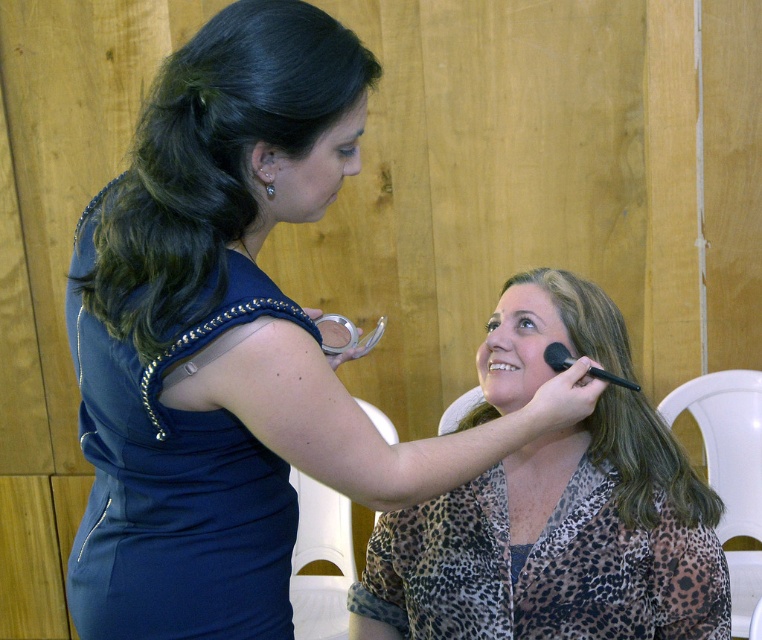
Which of these two, dark blue silky hair at upper left or white plastic chair at lower right, stands taller?

Standing taller between the two is white plastic chair at lower right.

Based on the photo, how distant is dark blue silky hair at upper left from white plastic chair at lower right?

dark blue silky hair at upper left is 4.87 feet from white plastic chair at lower right.

I want to click on dark blue silky hair at upper left, so click(213, 161).

Where is `dark blue silky hair at upper left`? Image resolution: width=762 pixels, height=640 pixels. dark blue silky hair at upper left is located at coordinates (213, 161).

Is matte blue dress at upper left taller than matte black makeup brush at upper right?

Correct, matte blue dress at upper left is much taller as matte black makeup brush at upper right.

Which of these two, matte blue dress at upper left or matte black makeup brush at upper right, stands shorter?

matte black makeup brush at upper right

Is point (335, 436) positioned before point (533, 344)?

Yes, point (335, 436) is closer to viewer.

I want to click on matte blue dress at upper left, so [x=226, y=349].

Does dark blue silky hair at upper left have a larger size compared to white plastic chair at right?

Incorrect, dark blue silky hair at upper left is not larger than white plastic chair at right.

Looking at this image, does dark blue silky hair at upper left have a lesser width compared to white plastic chair at right?

In fact, dark blue silky hair at upper left might be wider than white plastic chair at right.

Is point (200, 156) closer to camera compared to point (746, 595)?

That is True.

Locate an element on the screen. The height and width of the screenshot is (640, 762). dark blue silky hair at upper left is located at coordinates (213, 161).